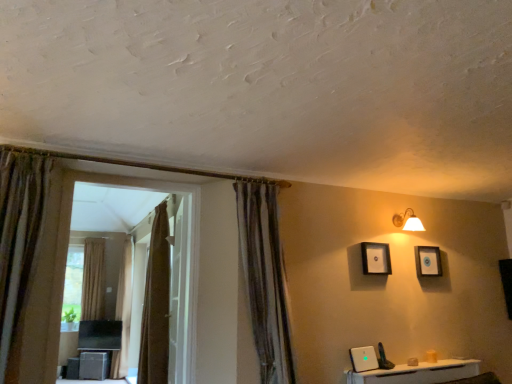
Measure the distance between point (176, 235) and camera.

3.37 meters.

At what (x,y) coordinates should I click in order to perform the action: click on brown textured curtain at left, which ranks as the 3th curtain in right-to-left order. Please return your answer as a coordinate pair (x, y). The width and height of the screenshot is (512, 384). Looking at the image, I should click on (123, 310).

The width and height of the screenshot is (512, 384). I want to click on matte wooden picture frame at upper right, the 2th picture frame viewed from the front, so pyautogui.click(x=428, y=261).

Describe the element at coordinates (265, 279) in the screenshot. I see `brown textured curtain at center, placed as the first curtain when sorted from front to back` at that location.

The width and height of the screenshot is (512, 384). Identify the location of white glossy router at lower right. (418, 373).

You are a GUI agent. You are given a task and a screenshot of the screen. Output one action in this format:
    pyautogui.click(x=<x>, y=<y>)
    Task: Click on the brown fabric bay window at left
    
    Given the screenshot: What is the action you would take?
    pyautogui.click(x=175, y=266)

From the picture: Who is smaller, matte gold wall sconce at upper right or beige fabric curtain at left, positioned as the fourth curtain in front-to-back order?

With smaller size is matte gold wall sconce at upper right.

Would you say matte gold wall sconce at upper right is a long distance from beige fabric curtain at left, which is counted as the 4th curtain, starting from the right?

matte gold wall sconce at upper right is positioned a significant distance from beige fabric curtain at left, which is counted as the 4th curtain, starting from the right.

From the image's perspective, between matte gold wall sconce at upper right and beige fabric curtain at left, the 1th curtain when ordered from back to front, who is located below?

beige fabric curtain at left, the 1th curtain when ordered from back to front, from the image's perspective.

The image size is (512, 384). What are the coordinates of `curtain that is the 3rd object located below the matte gold wall sconce at upper right (from the image's perspective)` in the screenshot? It's located at (93, 280).

From a real-world perspective, is brown textured curtain at left, the second curtain in the left-to-right sequence, positioned over brown fabric bay window at left based on gravity?

No, from a real-world perspective, brown textured curtain at left, the second curtain in the left-to-right sequence, is not over brown fabric bay window at left

How distant is brown textured curtain at left, marked as the third curtain in a front-to-back arrangement, from brown fabric bay window at left?

brown textured curtain at left, marked as the third curtain in a front-to-back arrangement, and brown fabric bay window at left are 6.53 inches apart.

What's the angular difference between brown textured curtain at left, marked as the third curtain in a front-to-back arrangement, and brown fabric bay window at left's facing directions?

The facing directions of brown textured curtain at left, marked as the third curtain in a front-to-back arrangement, and brown fabric bay window at left are 90.8 degrees apart.

Is brown textured curtain at left, which ranks as the 3th curtain in right-to-left order, surrounding brown fabric bay window at left?

No, brown fabric bay window at left is not inside brown textured curtain at left, which ranks as the 3th curtain in right-to-left order.

Between white glossy router at lower right and matte gold wall sconce at upper right, which one is positioned in front?

white glossy router at lower right.

You are a GUI agent. You are given a task and a screenshot of the screen. Output one action in this format:
    pyautogui.click(x=<x>, y=<y>)
    Task: Click on the furniture to the left of matte gold wall sconce at upper right
    The height and width of the screenshot is (384, 512).
    Given the screenshot: What is the action you would take?
    pyautogui.click(x=418, y=373)

Is white glossy router at lower right bigger or smaller than matte gold wall sconce at upper right?

white glossy router at lower right is smaller than matte gold wall sconce at upper right.

From the image's perspective, relative to matte gold wall sconce at upper right, is white glossy router at lower right above or below?

Based on their image positions, white glossy router at lower right is located beneath matte gold wall sconce at upper right.

Can you confirm if matte black picture frame at upper center, the 1th picture frame when ordered from front to back, is positioned to the right of beige fabric curtain at left, the 1th curtain when ordered from back to front?

Indeed, matte black picture frame at upper center, the 1th picture frame when ordered from front to back, is positioned on the right side of beige fabric curtain at left, the 1th curtain when ordered from back to front.

Is matte black picture frame at upper center, acting as the 2th picture frame starting from the right, located outside beige fabric curtain at left, which is counted as the 4th curtain, starting from the right?

Yes, matte black picture frame at upper center, acting as the 2th picture frame starting from the right, is outside of beige fabric curtain at left, which is counted as the 4th curtain, starting from the right.

How many degrees apart are the facing directions of matte black picture frame at upper center, acting as the 2th picture frame starting from the right, and beige fabric curtain at left, positioned as the fourth curtain in front-to-back order?

They differ by 0.0039 degrees in their facing directions.

From the image's perspective, between matte black picture frame at upper center, acting as the 2th picture frame starting from the right, and beige fabric curtain at left, which is counted as the 4th curtain, starting from the right, which one is located above?

matte black picture frame at upper center, acting as the 2th picture frame starting from the right, from the image's perspective.

From the matte black picture frame at upper center, acting as the 2th picture frame starting from the right, count the 1st curtain to the left and point to it. Please provide its 2D coordinates.

[(265, 279)]

How distant is brown textured curtain at center, placed as the first curtain when sorted from front to back, from matte black picture frame at upper center, the 1th picture frame when ordered from front to back?

brown textured curtain at center, placed as the first curtain when sorted from front to back, is 39.22 inches away from matte black picture frame at upper center, the 1th picture frame when ordered from front to back.

Is the position of brown textured curtain at center, placed as the first curtain when sorted from front to back, more distant than that of matte black picture frame at upper center, the 1th picture frame when ordered from front to back?

No, it is not.

Considering the sizes of brown textured curtain at center, the 4th curtain viewed from the back, and matte black picture frame at upper center, the second picture frame viewed from the back, in the image, is brown textured curtain at center, the 4th curtain viewed from the back, taller or shorter than matte black picture frame at upper center, the second picture frame viewed from the back,?

In the image, brown textured curtain at center, the 4th curtain viewed from the back, appears to be taller than matte black picture frame at upper center, the second picture frame viewed from the back.

Which object is further away from the camera taking this photo, brown fabric bay window at left or matte black picture frame at upper center, the second picture frame viewed from the back?

matte black picture frame at upper center, the second picture frame viewed from the back.

Would you say brown fabric bay window at left is outside matte black picture frame at upper center, positioned as the 1th picture frame in left-to-right order?

Absolutely, brown fabric bay window at left is external to matte black picture frame at upper center, positioned as the 1th picture frame in left-to-right order.

How much distance is there between brown fabric bay window at left and matte black picture frame at upper center, acting as the 2th picture frame starting from the right?

brown fabric bay window at left is 2.88 meters away from matte black picture frame at upper center, acting as the 2th picture frame starting from the right.

Which object is positioned more to the right, brown fabric bay window at left or matte black picture frame at upper center, the 1th picture frame when ordered from front to back?

From the viewer's perspective, matte black picture frame at upper center, the 1th picture frame when ordered from front to back, appears more on the right side.

From a real-world perspective, is brown textured curtain at center, the fourth curtain viewed from the left, below white glossy door at center?

No, from a real-world perspective, brown textured curtain at center, the fourth curtain viewed from the left, is not under white glossy door at center.

Who is more distant, brown textured curtain at center, placed as the first curtain when sorted from front to back, or white glossy door at center?

white glossy door at center.

Considering the relative sizes of brown textured curtain at center, placed as the first curtain when sorted from front to back, and white glossy door at center in the image provided, is brown textured curtain at center, placed as the first curtain when sorted from front to back, thinner than white glossy door at center?

No.

Is brown textured curtain at center, the 4th curtain viewed from the back, in contact with white glossy door at center?

No, brown textured curtain at center, the 4th curtain viewed from the back, is not beside white glossy door at center.

Find the location of `curtain that is the 4th one when counting leftward from the matte gold wall sconce at upper right`. curtain that is the 4th one when counting leftward from the matte gold wall sconce at upper right is located at coordinates (93, 280).

Locate an element on the screen. bay window on the right of brown textured curtain at left, which is the 2th curtain from back to front is located at coordinates (175, 266).

Estimate the real-world distances between objects in this image. Which object is further from white glossy door at center, brown fabric curtain at center, which is counted as the second curtain, starting from the front, or matte black picture frame at upper center, acting as the 2th picture frame starting from the right?

matte black picture frame at upper center, acting as the 2th picture frame starting from the right, lies further to white glossy door at center than the other object.

Which object lies further to the anchor point matte gold wall sconce at upper right, brown fabric bay window at left or brown textured curtain at center, the 4th curtain viewed from the back?

brown fabric bay window at left is further to matte gold wall sconce at upper right.

When comparing their distances from matte wooden picture frame at upper right, which ranks as the 2th picture frame in left-to-right order, does brown fabric bay window at left or brown textured curtain at left, which ranks as the 3th curtain in right-to-left order, seem further?

Among the two, brown textured curtain at left, which ranks as the 3th curtain in right-to-left order, is located further to matte wooden picture frame at upper right, which ranks as the 2th picture frame in left-to-right order.

Looking at this image, when comparing their distances from brown fabric bay window at left, does brown textured curtain at center, positioned as the first curtain in right-to-left order, or beige fabric curtain at left, which is counted as the 4th curtain, starting from the right, seem closer?

Among the two, beige fabric curtain at left, which is counted as the 4th curtain, starting from the right, is located nearer to brown fabric bay window at left.

Estimate the real-world distances between objects in this image. Which object is further from brown textured curtain at center, placed as the first curtain when sorted from front to back, brown fabric bay window at left or matte gold wall sconce at upper right?

brown fabric bay window at left is positioned further to the anchor brown textured curtain at center, placed as the first curtain when sorted from front to back.

Based on their spatial positions, is brown fabric curtain at center, which is counted as the second curtain, starting from the front, or brown textured curtain at left, which is the 2th curtain from back to front, further from beige fabric curtain at left, positioned as the first curtain in left-to-right order?

Based on the image, brown fabric curtain at center, which is counted as the second curtain, starting from the front, appears to be further to beige fabric curtain at left, positioned as the first curtain in left-to-right order.

Based on their spatial positions, is matte gold wall sconce at upper right or brown fabric bay window at left closer to matte black picture frame at upper center, the 1th picture frame when ordered from front to back?

matte gold wall sconce at upper right is closer to matte black picture frame at upper center, the 1th picture frame when ordered from front to back.

When comparing their distances from matte black picture frame at upper center, positioned as the 1th picture frame in left-to-right order, does brown textured curtain at left, marked as the third curtain in a front-to-back arrangement, or matte wooden picture frame at upper right, the 1th picture frame from the right, seem closer?

matte wooden picture frame at upper right, the 1th picture frame from the right.

What are the coordinates of `furniture between brown textured curtain at center, the 4th curtain viewed from the back, and matte gold wall sconce at upper right` in the screenshot? It's located at (418, 373).

Where is `screen door between brown textured curtain at left, the second curtain in the left-to-right sequence, and matte wooden picture frame at upper right, which ranks as the 2th picture frame in left-to-right order, in the horizontal direction`? screen door between brown textured curtain at left, the second curtain in the left-to-right sequence, and matte wooden picture frame at upper right, which ranks as the 2th picture frame in left-to-right order, in the horizontal direction is located at coordinates (178, 285).

The width and height of the screenshot is (512, 384). What are the coordinates of `curtain between white glossy door at center and matte black picture frame at upper center, positioned as the 1th picture frame in left-to-right order, in the horizontal direction` in the screenshot? It's located at (265, 279).

What are the coordinates of `furniture positioned between brown textured curtain at center, placed as the first curtain when sorted from front to back, and beige fabric curtain at left, positioned as the first curtain in left-to-right order, from near to far` in the screenshot? It's located at (418, 373).